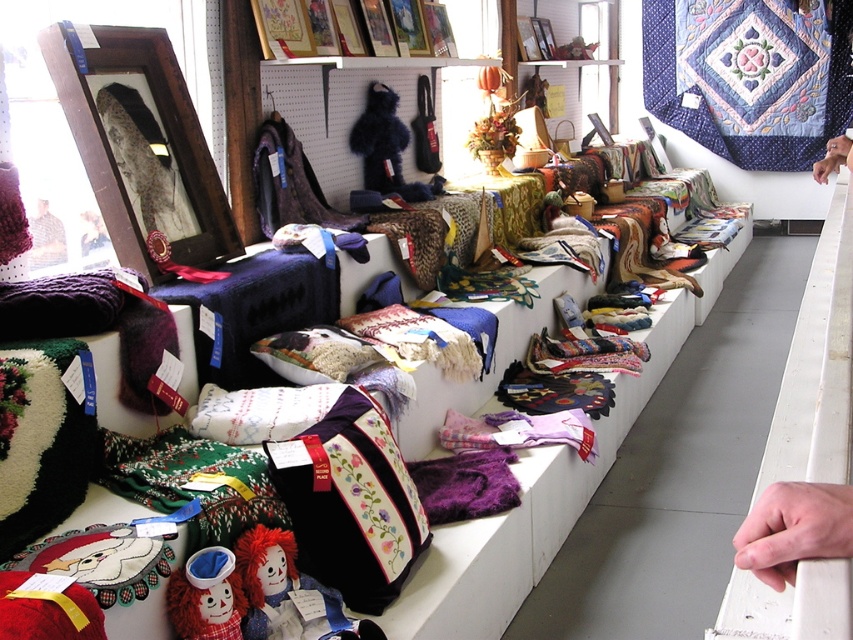
Based on the scene description, where is the smooth skin hand at lower right located in terms of coordinates?

The smooth skin hand at lower right is located at coordinates point (793, 529).

You are a customer at the craft fair and want to touch both the smooth skin hand at lower right and the fuzzy fur coat at left. Which object is located lower in the image?

The smooth skin hand at lower right is located below the fuzzy fur coat at left, so it is lower in the image.

You are a customer at the craft fair and want to examine both the fuzzy fur coat at left and the smooth skin hand at upper right. Which object is closer to you as you approach the display?

The fuzzy fur coat at left is closer to you because it is in front of the smooth skin hand at upper right.